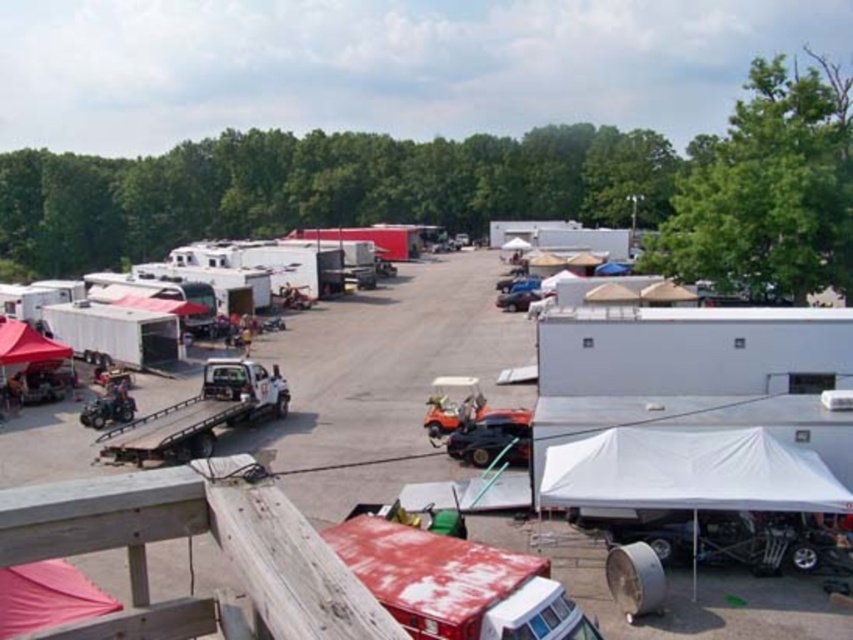
Can you confirm if white matte trailer at center is taller than white fabric tent at lower right?

Yes, white matte trailer at center is taller than white fabric tent at lower right.

Does white matte trailer at center appear over white fabric tent at lower right?

Indeed, white matte trailer at center is positioned over white fabric tent at lower right.

Does point (663, 618) come farther from viewer compared to point (590, 484)?

No, it is not.

This screenshot has width=853, height=640. I want to click on white matte trailer at center, so click(381, 381).